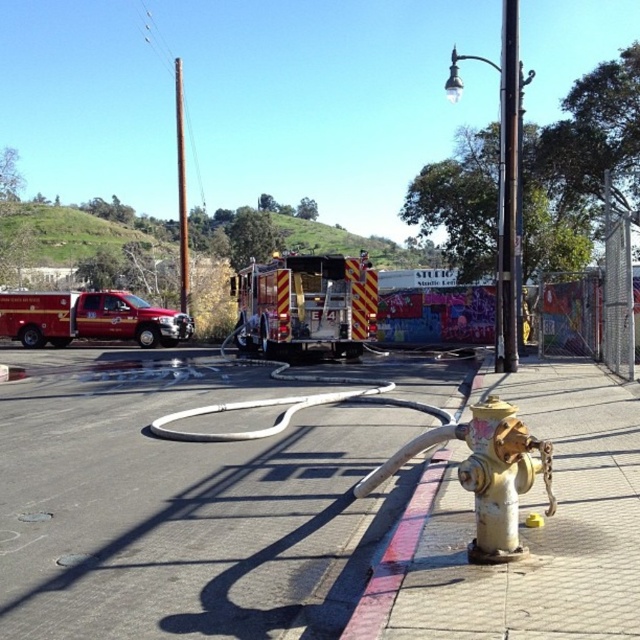
You are a firefighter assessing the scene. You need to determine which object is taller between the yellow metallic hydrant at lower right and the brushed metal pole at upper center. Based on the scene, which one is taller?

The yellow metallic hydrant at lower right is shorter than the brushed metal pole at upper center, so the brushed metal pole at upper center is taller.

You need to determine if the white rubber hose at center can fit through a narrow opening that is just wide enough for the yellow metallic hydrant at lower right. Based on their widths, would the hose fit?

The white rubber hose at center might be wider than the yellow metallic hydrant at lower right, so it may not fit through the narrow opening designed for the hydrant.

You are a firefighter trying to connect a new hose to the hydrant. The new hose you have is 10 feet long. Based on the scene, will the hose reach from the white rubber hose at center to the yellow metallic hydrant at lower right?

The white rubber hose at center and yellow metallic hydrant at lower right are 12.51 feet apart. Since the new hose is only 10 feet long, it will not be long enough to reach between them.